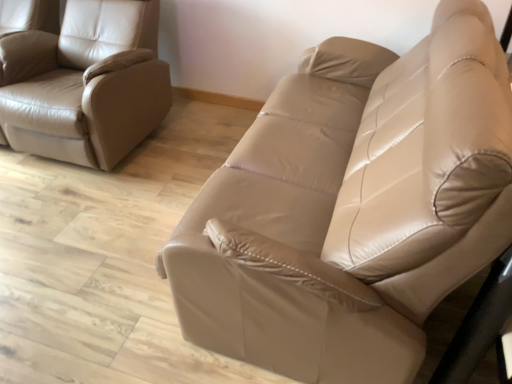
Locate an element on the screen. This screenshot has width=512, height=384. vacant point to the right of matte leather chair at left is located at coordinates (199, 145).